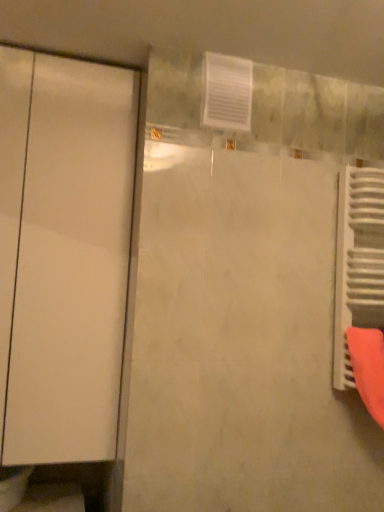
Question: Considering the relative positions of white glossy door at left and white metallic radiator at right in the image provided, is white glossy door at left to the left or to the right of white metallic radiator at right?

Choices:
 (A) right
 (B) left

Answer: (B)

Question: From the image's perspective, is white glossy door at left positioned above or below white metallic radiator at right?

Choices:
 (A) above
 (B) below

Answer: (A)

Question: From a real-world perspective, is white glossy door at left positioned above or below white metallic radiator at right?

Choices:
 (A) above
 (B) below

Answer: (A)

Question: From a real-world perspective, is white metallic radiator at right above or below white glossy door at left?

Choices:
 (A) below
 (B) above

Answer: (A)

Question: From the image's perspective, relative to white glossy door at left, is white metallic radiator at right above or below?

Choices:
 (A) above
 (B) below

Answer: (B)

Question: In terms of height, does white metallic radiator at right look taller or shorter compared to white glossy door at left?

Choices:
 (A) tall
 (B) short

Answer: (B)

Question: Considering the relative positions of white metallic radiator at right and white glossy door at left in the image provided, is white metallic radiator at right to the left or to the right of white glossy door at left?

Choices:
 (A) left
 (B) right

Answer: (B)